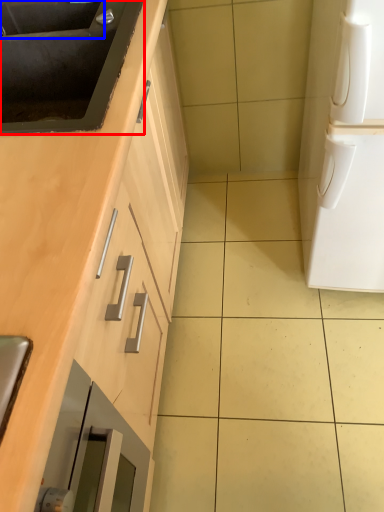
Question: Which object appears closest to the camera in this image, sink (highlighted by a red box) or sink (highlighted by a blue box)?

Choices:
 (A) sink
 (B) sink

Answer: (A)